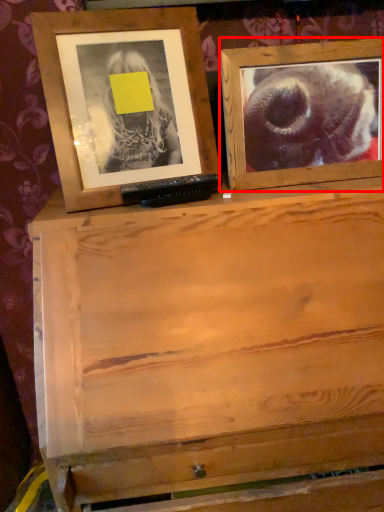
Question: From the image's perspective, considering the relative positions of picture frame (annotated by the red box) and picture frame in the image provided, where is picture frame (annotated by the red box) located with respect to the staircase?

Choices:
 (A) above
 (B) below

Answer: (B)